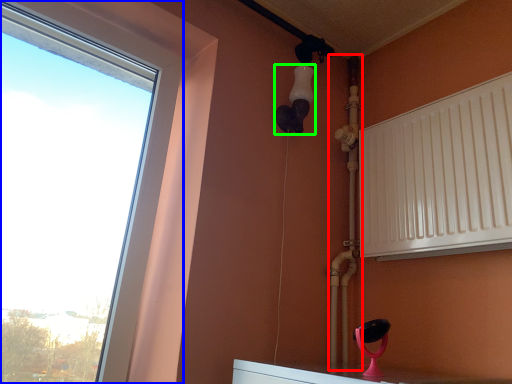
Question: Which object is positioned closest to pipe (highlighted by a red box)? Select from window (highlighted by a blue box) and light fixture (highlighted by a green box).

Choices:
 (A) window
 (B) light fixture

Answer: (B)